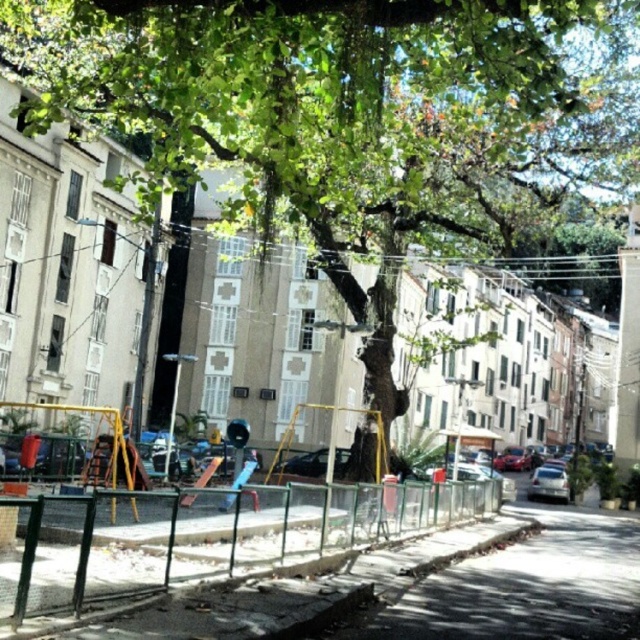
Who is more forward, (65, 608) or (312, 468)?

Point (65, 608)

At what (x,y) coordinates should I click in order to perform the action: click on green metal fence at center. Please return your answer as a coordinate pair (x, y). This screenshot has width=640, height=640. Looking at the image, I should click on (212, 536).

Does point (348, 497) come closer to viewer compared to point (321, 468)?

Yes.

Locate an element on the screen. The image size is (640, 640). green metal fence at center is located at coordinates (212, 536).

Between point (600, 525) and point (342, 460), which one is positioned in front?

Point (342, 460) is more forward.

Is gray concrete pavement at lower center taller than metallic silver car at center?

Yes.

Find the location of a particular element. This screenshot has width=640, height=640. gray concrete pavement at lower center is located at coordinates (524, 586).

Looking at this image, between green metal fence at center and silver metallic car at center, which one has more height?

With more height is green metal fence at center.

Does green metal fence at center appear on the right side of silver metallic car at center?

Incorrect, green metal fence at center is not on the right side of silver metallic car at center.

I want to click on green metal fence at center, so click(212, 536).

You are a GUI agent. You are given a task and a screenshot of the screen. Output one action in this format:
    pyautogui.click(x=<x>, y=<y>)
    Task: Click on the green metal fence at center
    
    Given the screenshot: What is the action you would take?
    pyautogui.click(x=212, y=536)